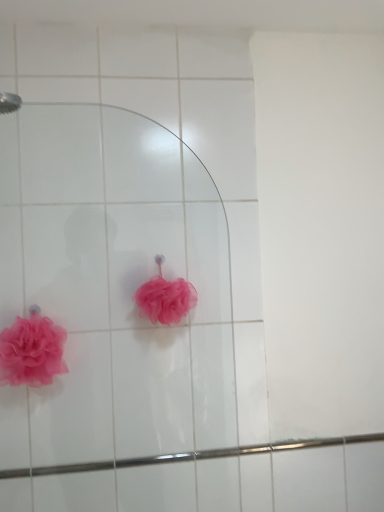
This screenshot has height=512, width=384. What do you see at coordinates (165, 298) in the screenshot?
I see `pink fluffy loofah at center, which ranks as the second flower in left-to-right order` at bounding box center [165, 298].

Where is `pink fluffy loofah at center, which ranks as the second flower in left-to-right order`? The width and height of the screenshot is (384, 512). pink fluffy loofah at center, which ranks as the second flower in left-to-right order is located at coordinates (165, 298).

How much space does pink fluffy loofah at center, which ranks as the second flower in left-to-right order, occupy horizontally?

pink fluffy loofah at center, which ranks as the second flower in left-to-right order, is 5.38 inches in width.

The image size is (384, 512). I want to click on matte pink loofah at lower left, the 2th flower positioned from the right, so click(32, 351).

Describe the element at coordinates (32, 351) in the screenshot. This screenshot has width=384, height=512. I see `matte pink loofah at lower left, which is counted as the first flower, starting from the left` at that location.

Identify the location of pink fluffy loofah at center, arranged as the first flower when viewed from the right. tap(165, 298).

Which object is positioned more to the left, matte pink loofah at lower left, which is counted as the first flower, starting from the left, or pink fluffy loofah at center, arranged as the first flower when viewed from the right?

From the viewer's perspective, matte pink loofah at lower left, which is counted as the first flower, starting from the left, appears more on the left side.

Is matte pink loofah at lower left, the 2th flower positioned from the right, in front of or behind pink fluffy loofah at center, which ranks as the second flower in left-to-right order, in the image?

matte pink loofah at lower left, the 2th flower positioned from the right, is in front of pink fluffy loofah at center, which ranks as the second flower in left-to-right order.

Considering the points (20, 340) and (158, 303), which point is behind, point (20, 340) or point (158, 303)?

Point (158, 303)

From the image's perspective, is matte pink loofah at lower left, the 2th flower positioned from the right, located above or below pink fluffy loofah at center, which ranks as the second flower in left-to-right order?

Clearly, from the image's perspective, matte pink loofah at lower left, the 2th flower positioned from the right, is below pink fluffy loofah at center, which ranks as the second flower in left-to-right order.

From a real-world perspective, who is located lower, matte pink loofah at lower left, which is counted as the first flower, starting from the left, or pink fluffy loofah at center, arranged as the first flower when viewed from the right?

matte pink loofah at lower left, which is counted as the first flower, starting from the left, is physically lower.

Does matte pink loofah at lower left, which is counted as the first flower, starting from the left, have a greater width compared to pink fluffy loofah at center, which ranks as the second flower in left-to-right order?

Incorrect, the width of matte pink loofah at lower left, which is counted as the first flower, starting from the left, does not surpass that of pink fluffy loofah at center, which ranks as the second flower in left-to-right order.

Between matte pink loofah at lower left, which is counted as the first flower, starting from the left, and pink fluffy loofah at center, arranged as the first flower when viewed from the right, which one has more height?

matte pink loofah at lower left, which is counted as the first flower, starting from the left, is taller.

From the picture: Does matte pink loofah at lower left, the 2th flower positioned from the right, have a larger size compared to pink fluffy loofah at center, arranged as the first flower when viewed from the right?

Yes.

In the scene shown: Would you say matte pink loofah at lower left, which is counted as the first flower, starting from the left, is inside or outside pink fluffy loofah at center, arranged as the first flower when viewed from the right?

matte pink loofah at lower left, which is counted as the first flower, starting from the left, is not enclosed by pink fluffy loofah at center, arranged as the first flower when viewed from the right.

From the picture: Is the surface of matte pink loofah at lower left, which is counted as the first flower, starting from the left, in direct contact with pink fluffy loofah at center, arranged as the first flower when viewed from the right?

No, matte pink loofah at lower left, which is counted as the first flower, starting from the left, is not next to pink fluffy loofah at center, arranged as the first flower when viewed from the right.

Is matte pink loofah at lower left, the 2th flower positioned from the right, looking in the opposite direction of pink fluffy loofah at center, which ranks as the second flower in left-to-right order?

matte pink loofah at lower left, the 2th flower positioned from the right, is not turned away from pink fluffy loofah at center, which ranks as the second flower in left-to-right order.

The image size is (384, 512). What are the coordinates of `flower above the matte pink loofah at lower left, the 2th flower positioned from the right (from the image's perspective)` in the screenshot? It's located at (165, 298).

Between pink fluffy loofah at center, which ranks as the second flower in left-to-right order, and matte pink loofah at lower left, which is counted as the first flower, starting from the left, which one appears on the left side from the viewer's perspective?

matte pink loofah at lower left, which is counted as the first flower, starting from the left, is more to the left.

Is the depth of pink fluffy loofah at center, which ranks as the second flower in left-to-right order, less than that of matte pink loofah at lower left, the 2th flower positioned from the right?

No, pink fluffy loofah at center, which ranks as the second flower in left-to-right order, is further to the viewer.

Considering the points (165, 285) and (2, 370), which point is in front, point (165, 285) or point (2, 370)?

The point (165, 285) is closer.

From the image's perspective, which is below, pink fluffy loofah at center, which ranks as the second flower in left-to-right order, or matte pink loofah at lower left, which is counted as the first flower, starting from the left?

matte pink loofah at lower left, which is counted as the first flower, starting from the left.

From a real-world perspective, relative to matte pink loofah at lower left, the 2th flower positioned from the right, is pink fluffy loofah at center, which ranks as the second flower in left-to-right order, vertically above or below?

pink fluffy loofah at center, which ranks as the second flower in left-to-right order, is situated higher than matte pink loofah at lower left, the 2th flower positioned from the right, in the real world.

Based on the photo, is pink fluffy loofah at center, which ranks as the second flower in left-to-right order, thinner than matte pink loofah at lower left, which is counted as the first flower, starting from the left?

In fact, pink fluffy loofah at center, which ranks as the second flower in left-to-right order, might be wider than matte pink loofah at lower left, which is counted as the first flower, starting from the left.

Considering the relative sizes of pink fluffy loofah at center, which ranks as the second flower in left-to-right order, and matte pink loofah at lower left, the 2th flower positioned from the right, in the image provided, is pink fluffy loofah at center, which ranks as the second flower in left-to-right order, shorter than matte pink loofah at lower left, the 2th flower positioned from the right,?

Correct, pink fluffy loofah at center, which ranks as the second flower in left-to-right order, is not as tall as matte pink loofah at lower left, the 2th flower positioned from the right.

Can you confirm if pink fluffy loofah at center, which ranks as the second flower in left-to-right order, is bigger than matte pink loofah at lower left, the 2th flower positioned from the right?

No.

Does pink fluffy loofah at center, arranged as the first flower when viewed from the right, contain matte pink loofah at lower left, the 2th flower positioned from the right?

Actually, matte pink loofah at lower left, the 2th flower positioned from the right, is outside pink fluffy loofah at center, arranged as the first flower when viewed from the right.

Would you consider pink fluffy loofah at center, which ranks as the second flower in left-to-right order, to be distant from matte pink loofah at lower left, the 2th flower positioned from the right?

No, pink fluffy loofah at center, which ranks as the second flower in left-to-right order, is not far from matte pink loofah at lower left, the 2th flower positioned from the right.

Is pink fluffy loofah at center, arranged as the first flower when viewed from the right, facing towards matte pink loofah at lower left, which is counted as the first flower, starting from the left?

No, pink fluffy loofah at center, arranged as the first flower when viewed from the right, is not aimed at matte pink loofah at lower left, which is counted as the first flower, starting from the left.

What's the angular difference between pink fluffy loofah at center, arranged as the first flower when viewed from the right, and matte pink loofah at lower left, which is counted as the first flower, starting from the left,'s facing directions?

7.23e-05 degrees.

At what (x,y) coordinates should I click in order to perform the action: click on flower on the right of matte pink loofah at lower left, the 2th flower positioned from the right. Please return your answer as a coordinate pair (x, y). The image size is (384, 512). Looking at the image, I should click on (165, 298).

The width and height of the screenshot is (384, 512). Identify the location of flower below the pink fluffy loofah at center, arranged as the first flower when viewed from the right (from a real-world perspective). (32, 351).

Where is `flower lying above the matte pink loofah at lower left, the 2th flower positioned from the right (from the image's perspective)`? The height and width of the screenshot is (512, 384). flower lying above the matte pink loofah at lower left, the 2th flower positioned from the right (from the image's perspective) is located at coordinates pos(165,298).